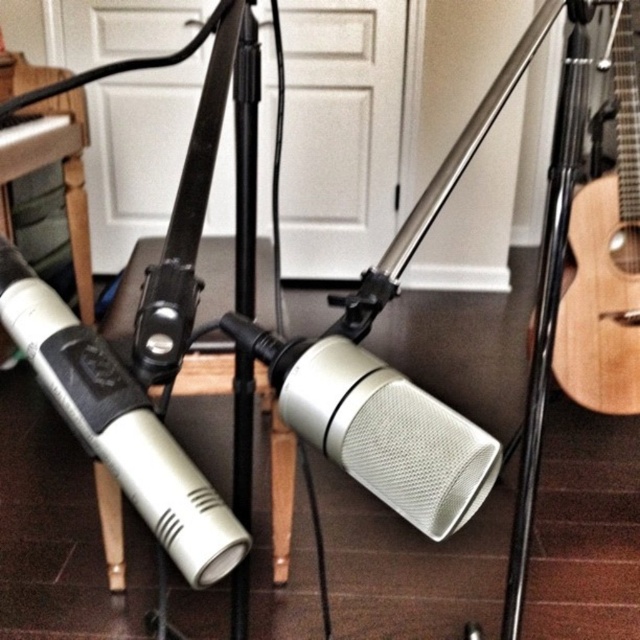
Consider the image. Is silver metallic microphone at left shorter than natural wood acoustic guitar at right?

Yes.

This screenshot has height=640, width=640. Describe the element at coordinates (120, 426) in the screenshot. I see `silver metallic microphone at left` at that location.

What do you see at coordinates (120, 426) in the screenshot? Image resolution: width=640 pixels, height=640 pixels. I see `silver metallic microphone at left` at bounding box center [120, 426].

Locate an element on the screen. The image size is (640, 640). silver metallic microphone at left is located at coordinates (120, 426).

Is silver mesh microphone at center shorter than silver metallic microphone at left?

Indeed, silver mesh microphone at center has a lesser height compared to silver metallic microphone at left.

Who is more forward, (432,492) or (54,320)?

Point (432,492)

Which is behind, point (280, 381) or point (124, 435)?

Point (280, 381)

Find the location of a particular element. silver mesh microphone at center is located at coordinates (378, 426).

Can you confirm if silver mesh microphone at center is thinner than natural wood acoustic guitar at right?

Yes.

Does silver mesh microphone at center appear under natural wood acoustic guitar at right?

Correct, silver mesh microphone at center is located below natural wood acoustic guitar at right.

Identify the location of silver mesh microphone at center. The height and width of the screenshot is (640, 640). (378, 426).